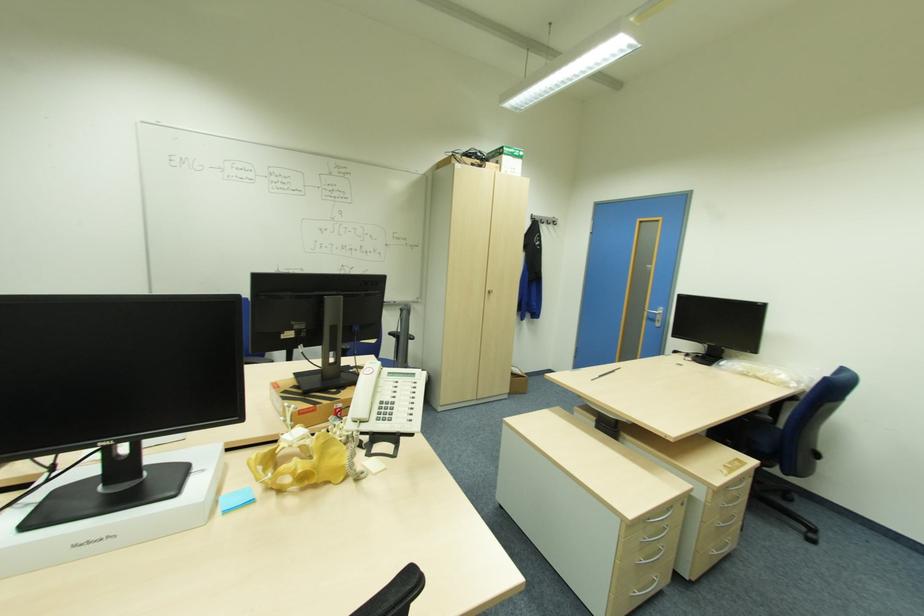
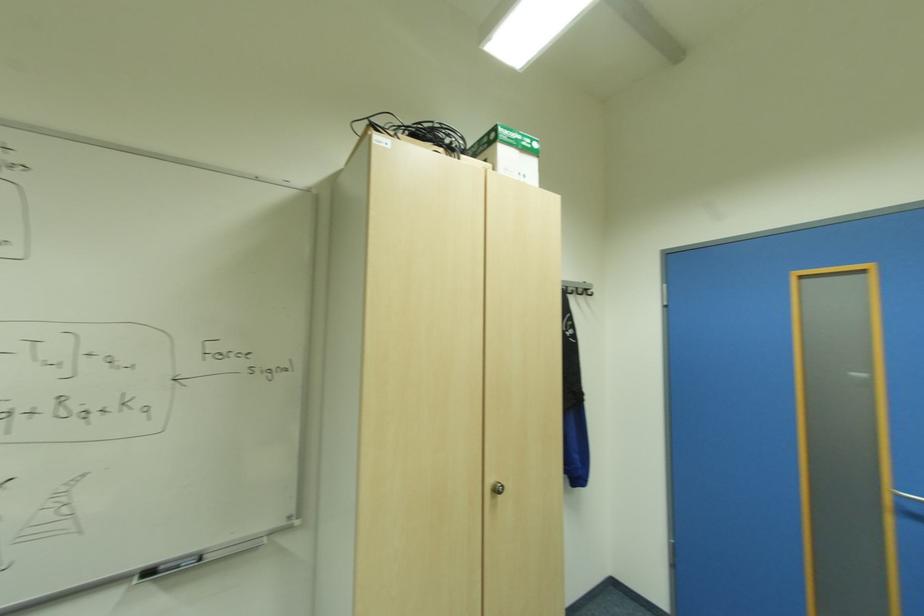
Where in the second image is the point corresponding to [555,222] from the first image?

(588, 291)